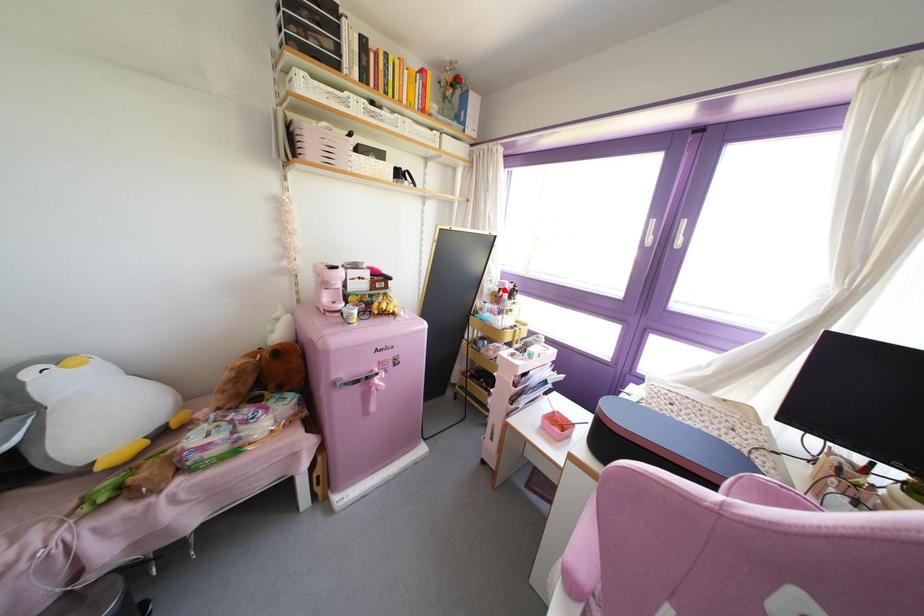
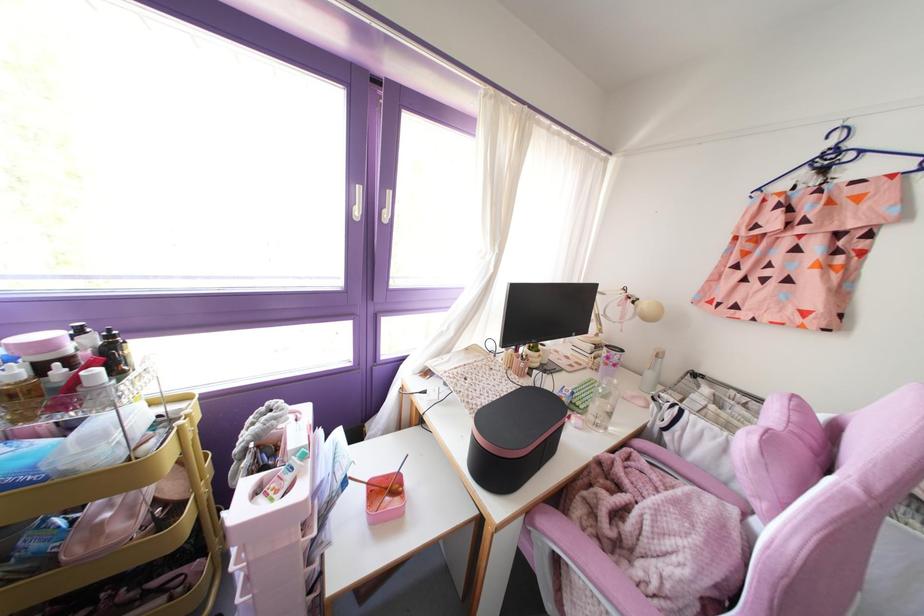
Find the pixel in the second image that matches the highlighted location in the first image.

(67, 360)